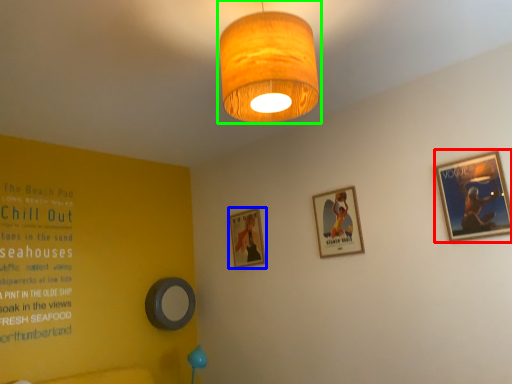
Question: Estimate the real-world distances between objects in this image. Which object is farther from picture frame (highlighted by a red box), picture frame (highlighted by a blue box) or lamp (highlighted by a green box)?

Choices:
 (A) picture frame
 (B) lamp

Answer: (A)